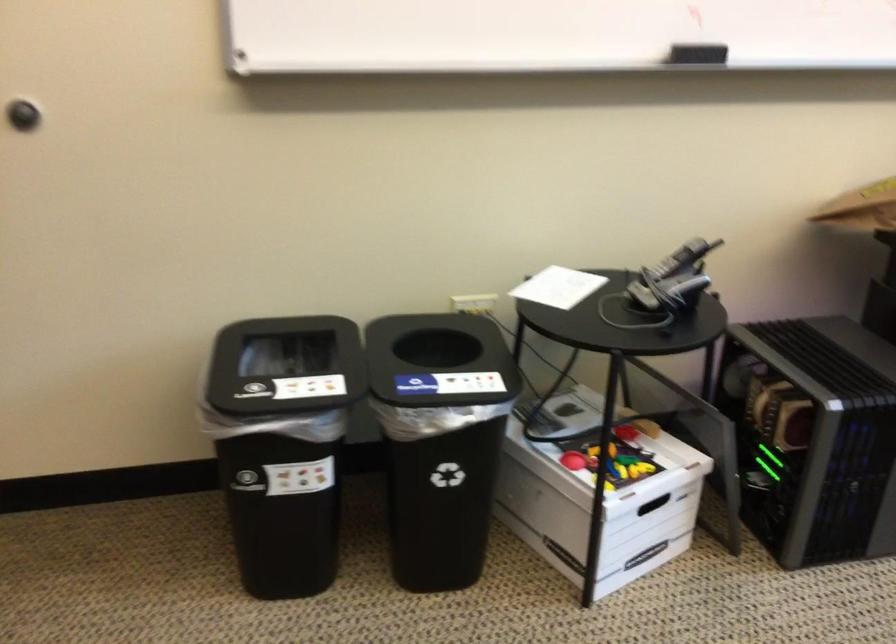
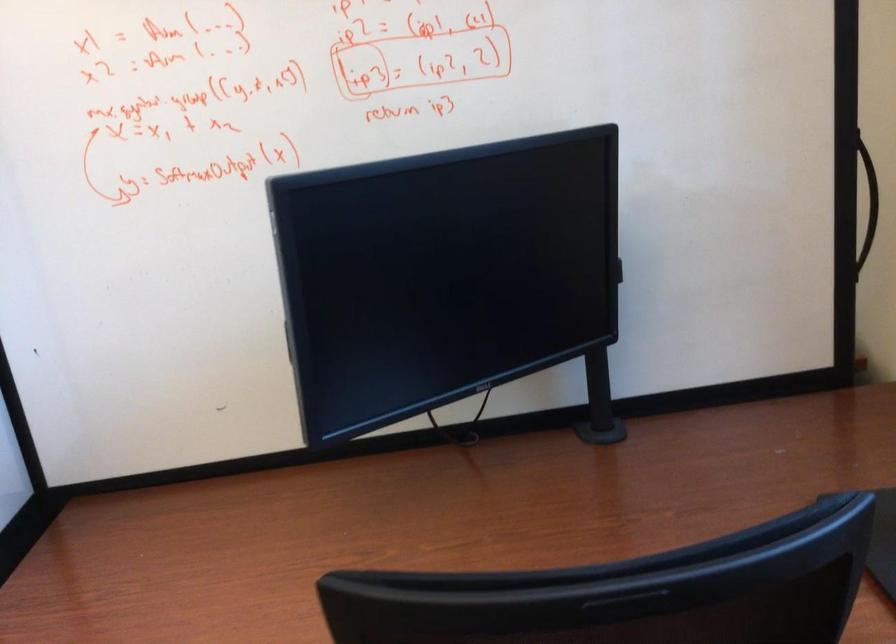
Which direction would the cameraman need to move to produce the second image?

The cameraman moved toward right, backward.